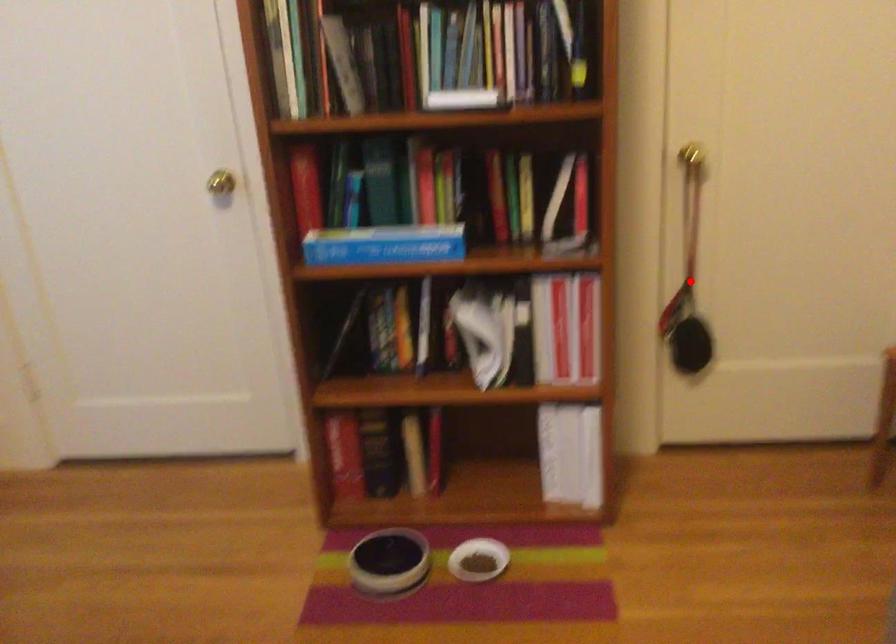
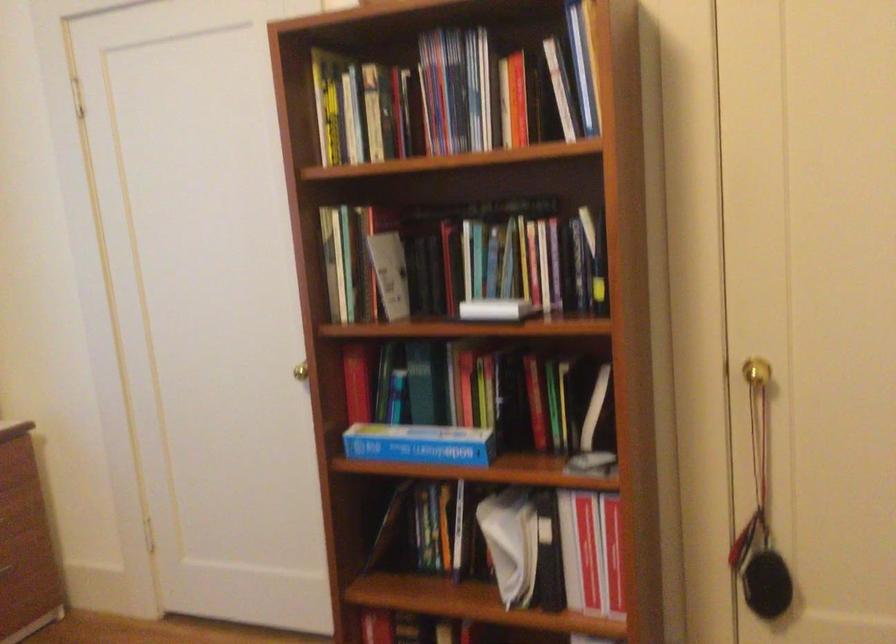
In the second image, find the point that corresponds to the highlighted location in the first image.

(762, 509)